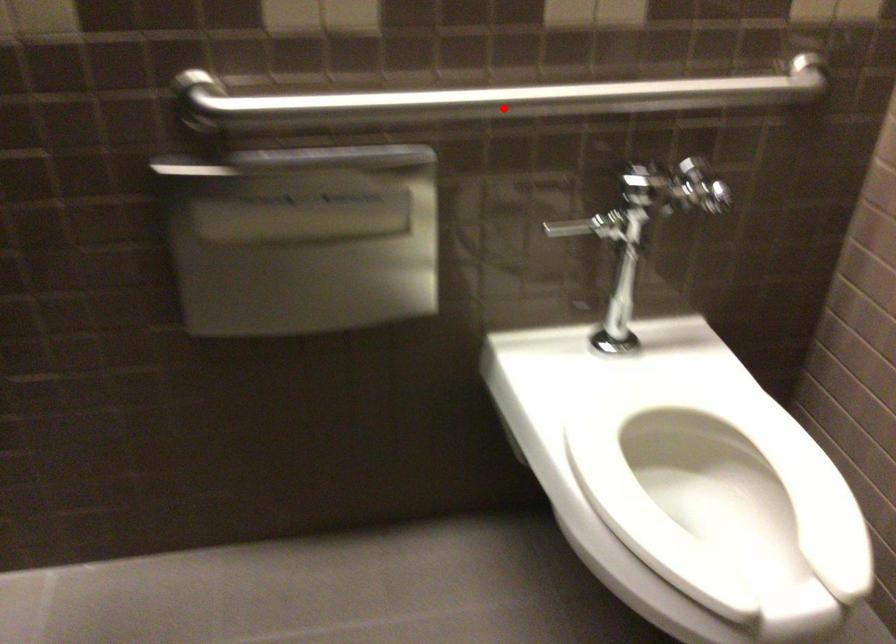
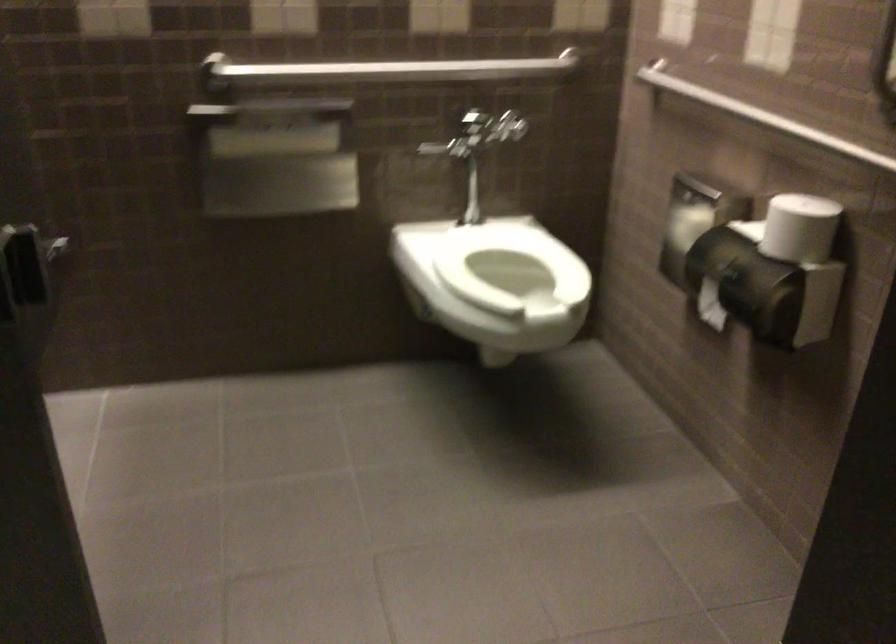
Question: I am providing you with two images of the same scene from different viewpoints. Image1 has a red point marked. In image2, the corresponding 3D location appears at what relative position? Reply with the corresponding letter.

Choices:
 (A) Closer
 (B) Farther

Answer: (B)